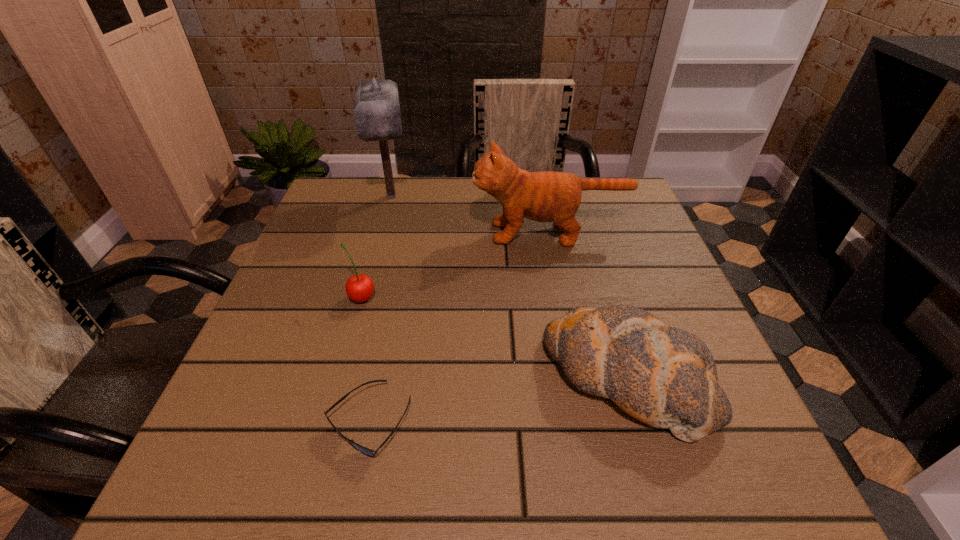
Identify the location of vacant space in between the third farthest object and the shortest object. The image size is (960, 540). (x=366, y=360).

At what (x,y) coordinates should I click in order to perform the action: click on free space between the third farthest object and the sunglasses. Please return your answer as a coordinate pair (x, y). Image resolution: width=960 pixels, height=540 pixels. Looking at the image, I should click on (366, 360).

Where is `vacant space in between the farthest object and the second tallest object`? This screenshot has height=540, width=960. vacant space in between the farthest object and the second tallest object is located at coordinates (470, 215).

Image resolution: width=960 pixels, height=540 pixels. Identify the location of free space between the shortest object and the cherry. (366, 360).

Find the location of a particular element. Image resolution: width=960 pixels, height=540 pixels. vacant region between the fourth nearest object and the sunglasses is located at coordinates (459, 328).

At what (x,y) coordinates should I click in order to perform the action: click on free space between the bread and the tallest object. Please return your answer as a coordinate pair (x, y). Image resolution: width=960 pixels, height=540 pixels. Looking at the image, I should click on [509, 287].

At what (x,y) coordinates should I click in order to perform the action: click on vacant point located between the second farthest object and the bread. Please return your answer as a coordinate pair (x, y). Looking at the image, I should click on (588, 306).

Find the location of a particular element. free space between the bread and the shortest object is located at coordinates (497, 400).

At what (x,y) coordinates should I click in order to perform the action: click on free spot between the farthest object and the bread. Please return your answer as a coordinate pair (x, y). This screenshot has width=960, height=540. Looking at the image, I should click on (509, 287).

The height and width of the screenshot is (540, 960). I want to click on free space between the bread and the cherry, so click(494, 338).